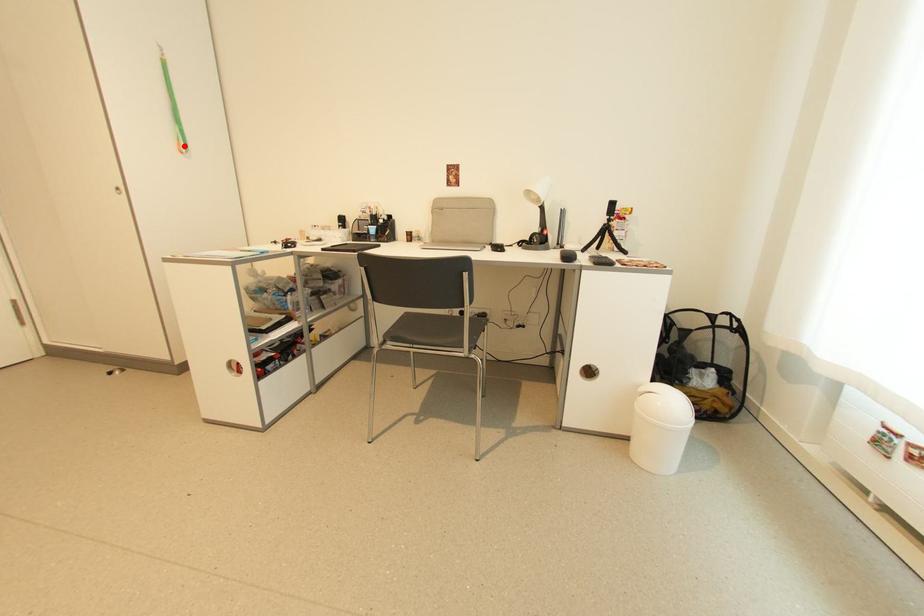
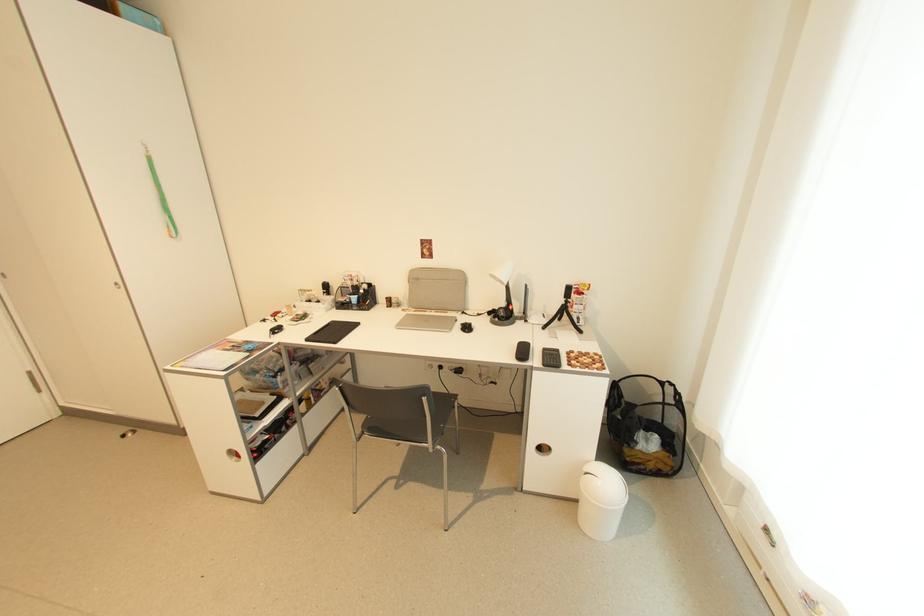
Where in the second image is the point corresponding to the highlighted location from the first image?

(175, 233)